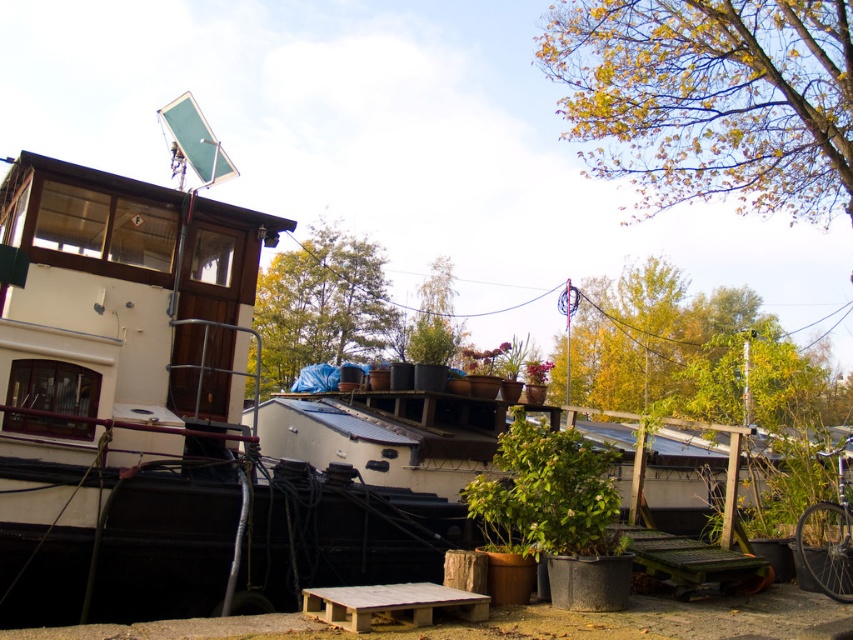
What color is the foliage located at the point marked by the coordinates (x=689, y=353) in the image?

The foliage at the point marked by the coordinates (x=689, y=353) is yellowish green in color.

You are planning to place a new small potted fern next to the green glossy plant at center and the wooden pallet at center. Which object should you place the fern closer to if you want it to be near the smaller object?

You should place the new small potted fern closer to the wooden pallet at center because the green glossy plant at center is bigger than the wooden pallet at center according to the description.